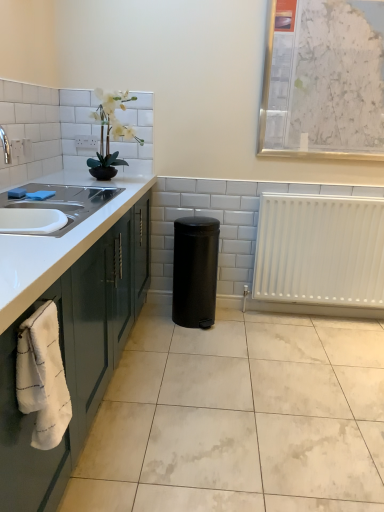
Question: Considering the relative positions of white plastic radiator at lower right and white marble bulletin board at upper right in the image provided, is white plastic radiator at lower right to the left of white marble bulletin board at upper right from the viewer's perspective?

Choices:
 (A) yes
 (B) no

Answer: (B)

Question: Does white plastic radiator at lower right have a lesser height compared to white marble bulletin board at upper right?

Choices:
 (A) no
 (B) yes

Answer: (B)

Question: Can white marble bulletin board at upper right be found inside white plastic radiator at lower right?

Choices:
 (A) no
 (B) yes

Answer: (A)

Question: Is white plastic radiator at lower right far away from white marble bulletin board at upper right?

Choices:
 (A) no
 (B) yes

Answer: (A)

Question: Is white plastic radiator at lower right touching white marble bulletin board at upper right?

Choices:
 (A) yes
 (B) no

Answer: (B)

Question: Does white plastic radiator at lower right have a greater width compared to white marble bulletin board at upper right?

Choices:
 (A) yes
 (B) no

Answer: (A)

Question: Is the depth of black matte trash can at center less than that of white glossy ceramic tile at lower center?

Choices:
 (A) no
 (B) yes

Answer: (A)

Question: Is black matte trash can at center surrounding white glossy ceramic tile at lower center?

Choices:
 (A) no
 (B) yes

Answer: (A)

Question: Is black matte trash can at center looking in the opposite direction of white glossy ceramic tile at lower center?

Choices:
 (A) yes
 (B) no

Answer: (B)

Question: Considering the relative sizes of black matte trash can at center and white glossy ceramic tile at lower center in the image provided, is black matte trash can at center smaller than white glossy ceramic tile at lower center?

Choices:
 (A) yes
 (B) no

Answer: (A)

Question: Can we say black matte trash can at center lies outside white glossy ceramic tile at lower center?

Choices:
 (A) no
 (B) yes

Answer: (B)

Question: From the image's perspective, is black matte trash can at center on top of white glossy ceramic tile at lower center?

Choices:
 (A) no
 (B) yes

Answer: (B)

Question: Is white marble bulletin board at upper right not within white plastic radiator at lower right?

Choices:
 (A) yes
 (B) no

Answer: (A)